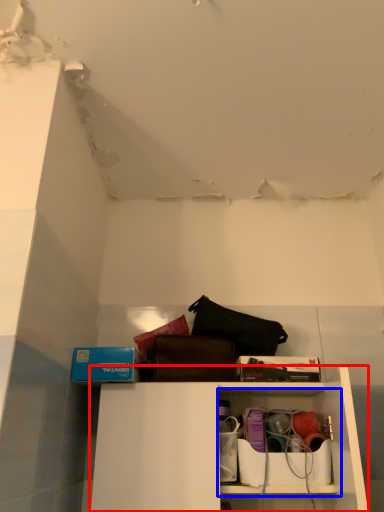
Question: Which point is further to the camera, shelf (highlighted by a red box) or cabinet (highlighted by a blue box)?

Choices:
 (A) shelf
 (B) cabinet

Answer: (B)